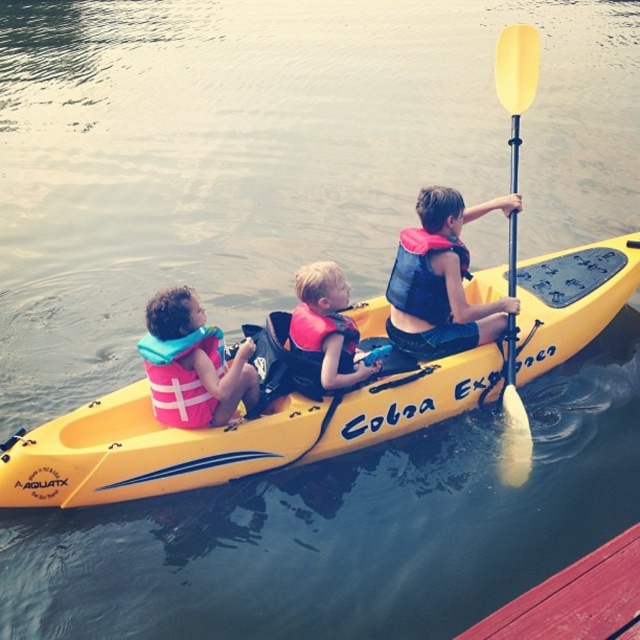
You are a photographer taking a picture of the blue life vest at center and the pink life vest at left. Based on their positions, which life vest should you focus on first to ensure both are in frame?

You should focus on the blue life vest at center first because the pink life vest at left is behind it, so adjusting focus starting from the front ensures both are in frame.

Consider the image. You are a safety inspector checking the kayak setup. The blue life vest at center and the pink life vest at center must be positioned so that the wider one is closer to the edge of the kayak for safety. Based on their sizes, which life vest should be moved to the edge?

The blue life vest at center should be moved to the edge since it is wider than the pink life vest at center according to the description.